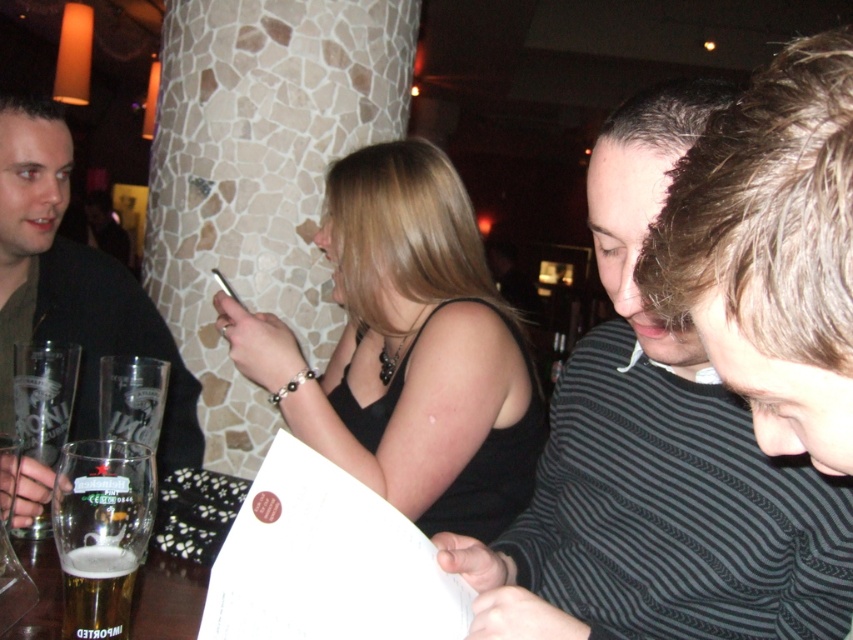
Does black matte tank top at center have a greater height compared to amber glass beer at lower left?

Yes, black matte tank top at center is taller than amber glass beer at lower left.

Looking at this image, does black matte tank top at center have a greater width compared to amber glass beer at lower left?

Indeed, black matte tank top at center has a greater width compared to amber glass beer at lower left.

Locate an element on the screen. black matte tank top at center is located at coordinates (408, 349).

At what (x,y) coordinates should I click in order to perform the action: click on black matte tank top at center. Please return your answer as a coordinate pair (x, y). The image size is (853, 640). Looking at the image, I should click on (408, 349).

Is striped sweater at center bigger than dark brown leather jacket at left?

Correct, striped sweater at center is larger in size than dark brown leather jacket at left.

Based on the photo, does striped sweater at center have a lesser width compared to dark brown leather jacket at left?

In fact, striped sweater at center might be wider than dark brown leather jacket at left.

Locate an element on the screen. The height and width of the screenshot is (640, 853). striped sweater at center is located at coordinates (657, 458).

At what (x,y) coordinates should I click in order to perform the action: click on striped sweater at center. Please return your answer as a coordinate pair (x, y). The width and height of the screenshot is (853, 640). Looking at the image, I should click on (657, 458).

Does striped sweater at center appear over black matte tank top at center?

Incorrect, striped sweater at center is not positioned above black matte tank top at center.

Which is more to the left, striped sweater at center or black matte tank top at center?

black matte tank top at center

Where is `striped sweater at center`? Image resolution: width=853 pixels, height=640 pixels. striped sweater at center is located at coordinates [x=657, y=458].